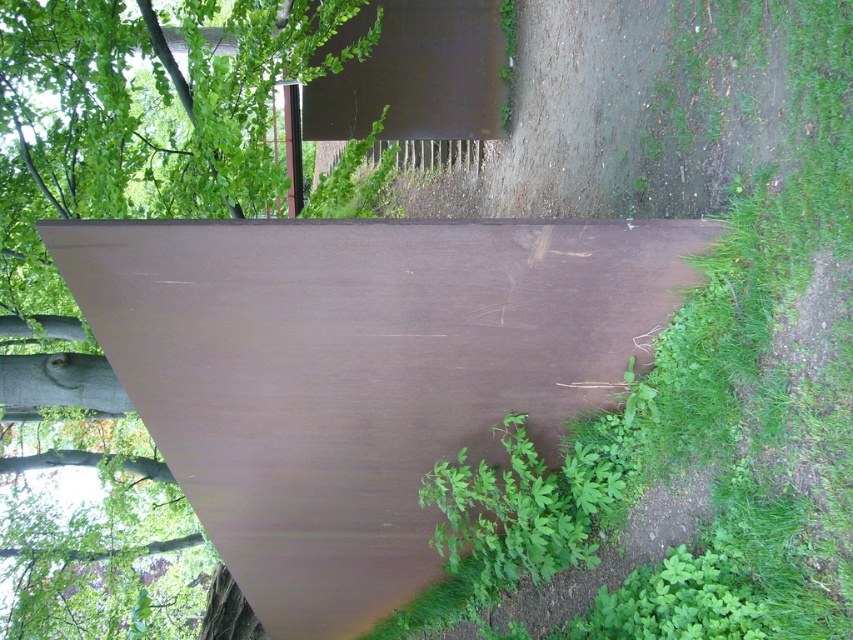
Can you confirm if brown matte board at center is positioned below green matte tree at upper left?

Yes.

Does brown matte board at center appear on the left side of green matte tree at upper left?

No, brown matte board at center is not to the left of green matte tree at upper left.

Who is more distant from viewer, (445, 339) or (161, 129)?

Point (161, 129)

I want to click on brown matte board at center, so click(358, 372).